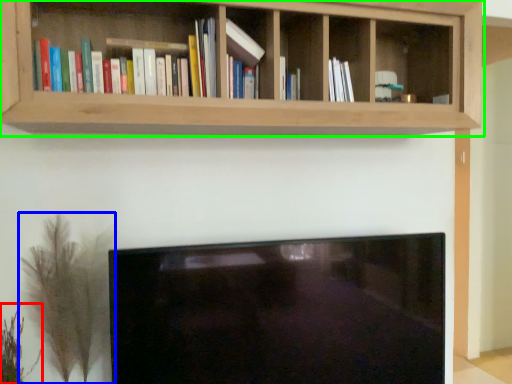
Question: Considering the real-world distances, which object is farthest from plant (highlighted by a red box)? plant (highlighted by a blue box) or shelf (highlighted by a green box)?

Choices:
 (A) plant
 (B) shelf

Answer: (B)